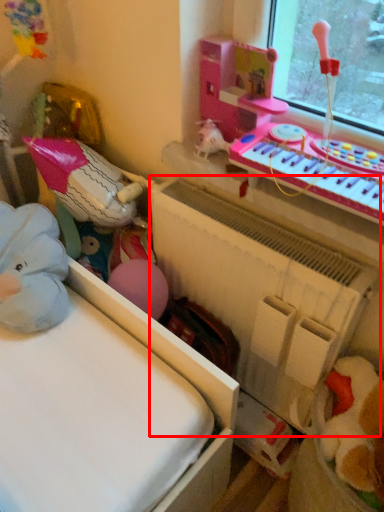
Question: From the image's perspective, where is radiator (annotated by the red box) located in relation to musical keyboard in the image?

Choices:
 (A) above
 (B) below

Answer: (B)